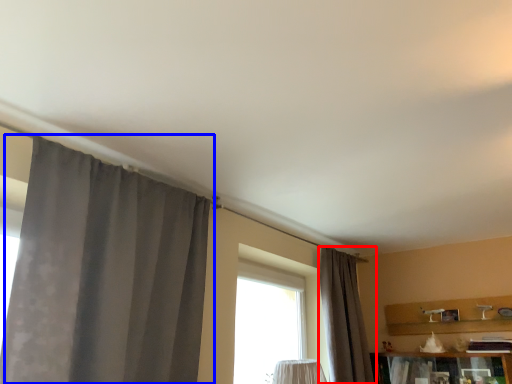
Question: Among these objects, which one is farthest to the camera, curtain (highlighted by a red box) or curtain (highlighted by a blue box)?

Choices:
 (A) curtain
 (B) curtain

Answer: (A)